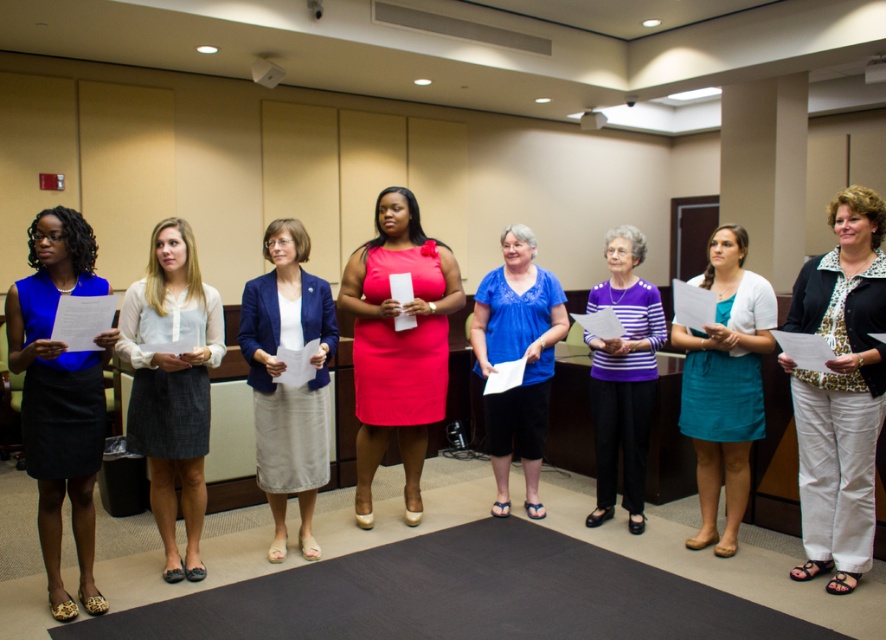
You are organizing a photo shoot and need to arrange the models so that the shorter item is placed in front of the taller one to ensure visibility. Given the gray wool skirt at center and the purple striped sweater at center, which one should be positioned in front?

The gray wool skirt at center is shorter than the purple striped sweater at center, so it should be placed in front to ensure visibility.